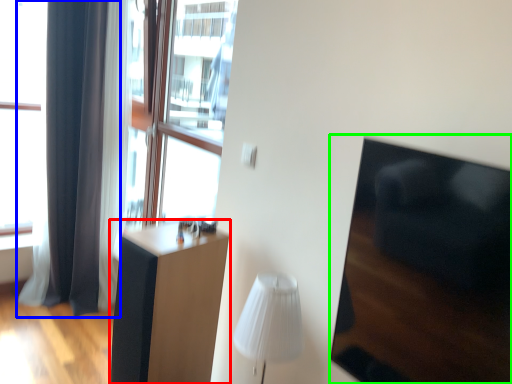
Question: Estimate the real-world distances between objects in this image. Which object is closer to furniture (highlighted by a red box), curtain (highlighted by a blue box) or armchair (highlighted by a green box)?

Choices:
 (A) curtain
 (B) armchair

Answer: (B)